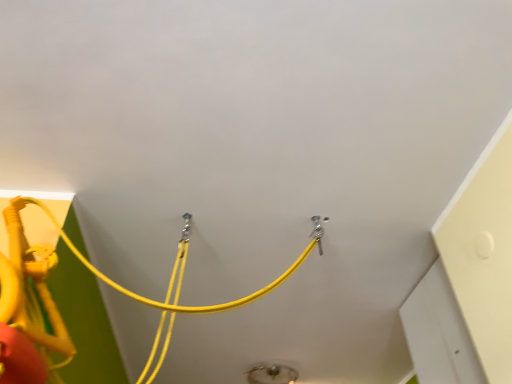
The height and width of the screenshot is (384, 512). What do you see at coordinates (181, 282) in the screenshot?
I see `yellow rope at upper left` at bounding box center [181, 282].

At what (x,y) coordinates should I click in order to perform the action: click on yellow rope at upper left. Please return your answer as a coordinate pair (x, y). The image size is (512, 384). Looking at the image, I should click on tap(181, 282).

Find the location of `yellow rope at upper left`. yellow rope at upper left is located at coordinates tap(181, 282).